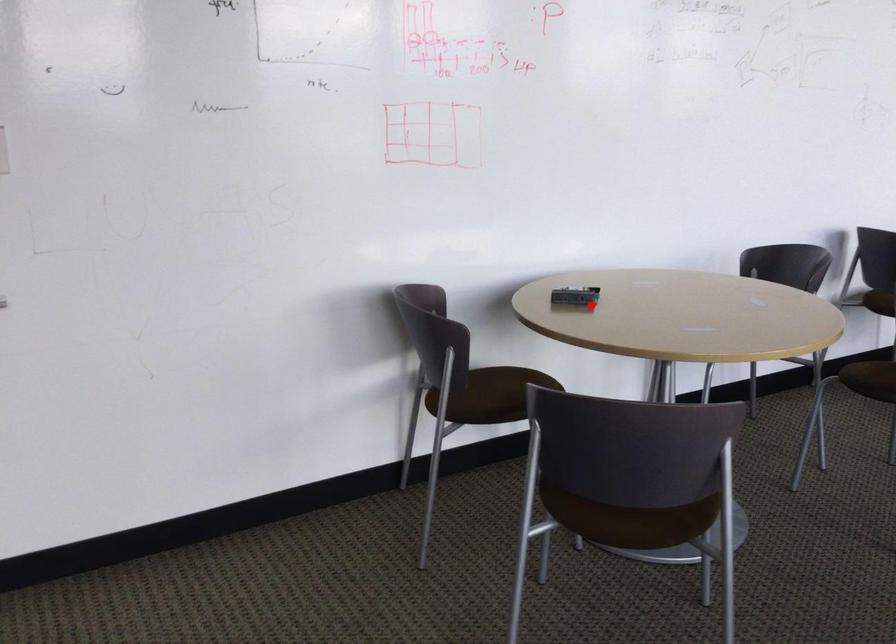
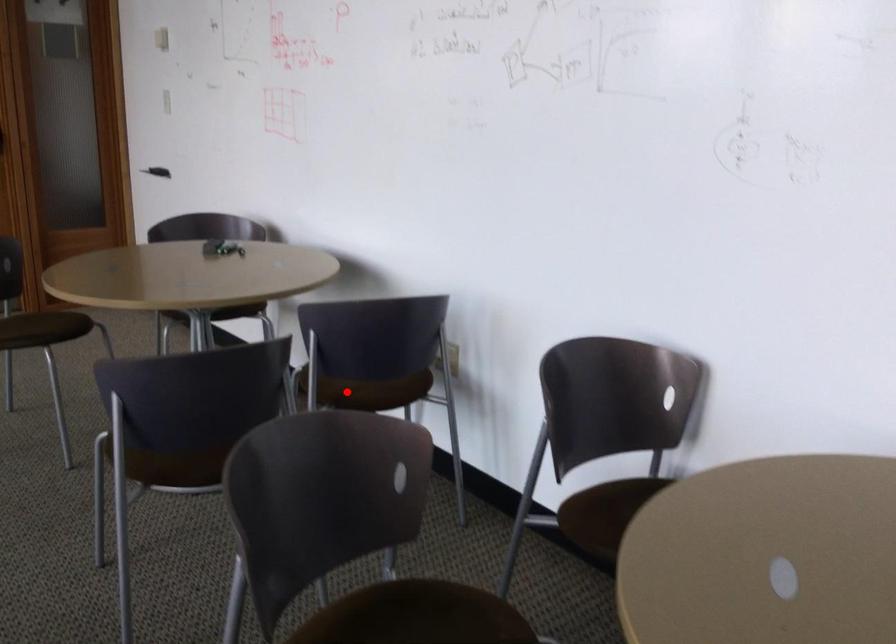
I am providing you with two images of the same scene from different viewpoints. A red point is marked on the first image and another point is marked on the second image. Do the highlighted points in image1 and image2 indicate the same real-world spot?

No